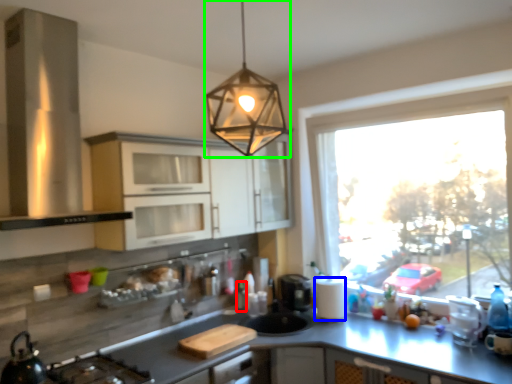
Question: Based on their relative distances, which object is farther from bottle (highlighted by a red box)? Choose from paper towel (highlighted by a blue box) and lamp (highlighted by a green box).

Choices:
 (A) paper towel
 (B) lamp

Answer: (B)